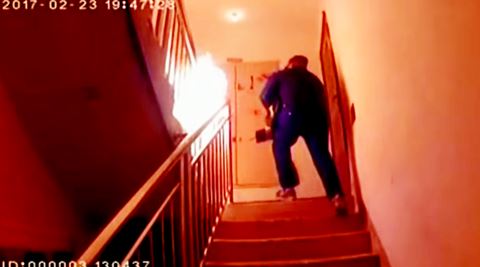
Where is `walls`? walls is located at coordinates (420, 135), (278, 49).